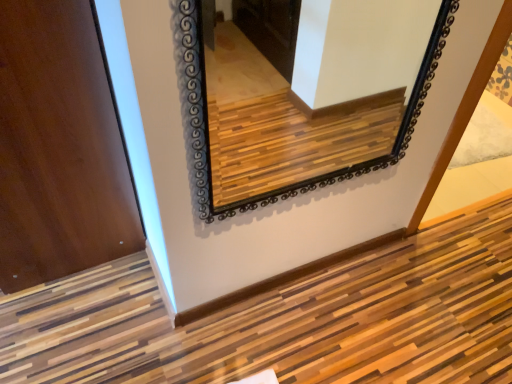
Locate an element on the screen. free spot to the right of matte wood door at left is located at coordinates (275, 167).